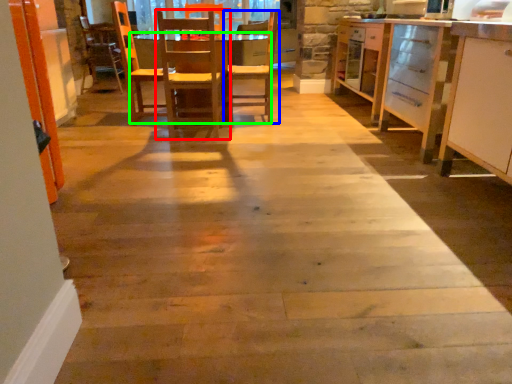
Question: Which object is positioned closest to chair (highlighted by a red box)? Select from chair (highlighted by a blue box) and table (highlighted by a green box).

Choices:
 (A) chair
 (B) table

Answer: (A)